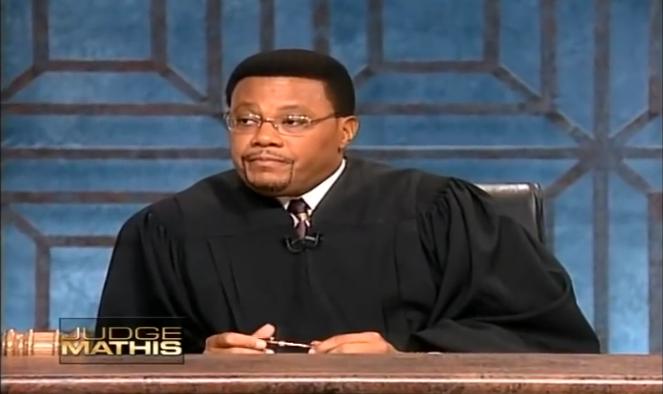
Identify the location of desk/bench. The height and width of the screenshot is (394, 663). (388, 366).